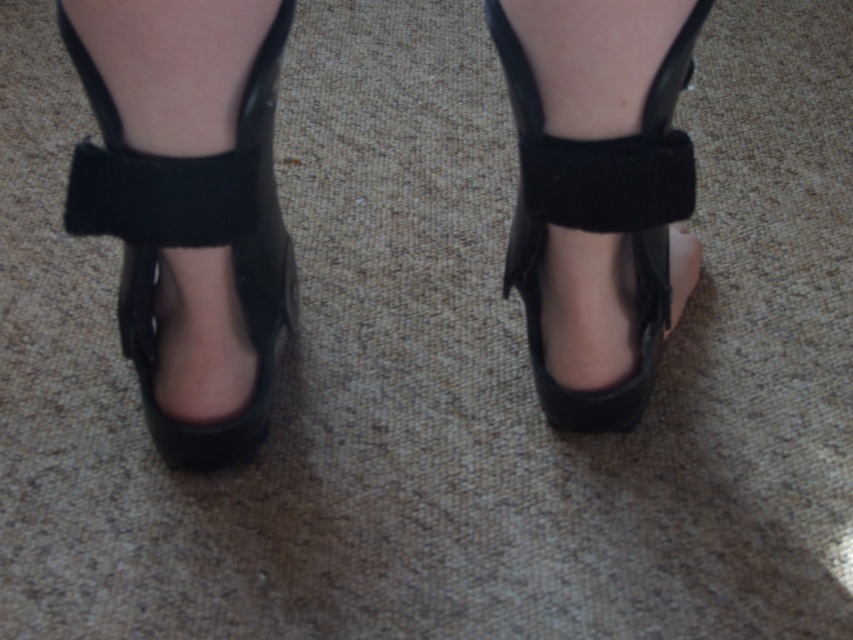
Question: Is black leather shoe at center positioned at the back of black suede shoe at center?

Choices:
 (A) no
 (B) yes

Answer: (A)

Question: Does shiny black platform shoes at center lie behind black leather shoe at center?

Choices:
 (A) yes
 (B) no

Answer: (B)

Question: Which point is farther to the camera?

Choices:
 (A) (654, 131)
 (B) (264, 141)
 (C) (525, 180)

Answer: (C)

Question: Which object appears farthest from the camera in this image?

Choices:
 (A) shiny black platform shoes at center
 (B) black leather shoe at center
 (C) black suede shoe at center

Answer: (C)

Question: Considering the relative positions of black leather shoe at center and black suede shoe at center in the image provided, where is black leather shoe at center located with respect to black suede shoe at center?

Choices:
 (A) left
 (B) right

Answer: (A)

Question: Estimate the real-world distances between objects in this image. Which object is closer to the shiny black platform shoes at center?

Choices:
 (A) black suede shoe at center
 (B) black leather shoe at center

Answer: (B)